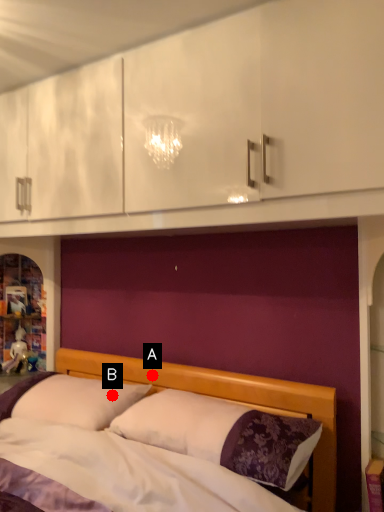
Question: Two points are circled on the image, labeled by A and B beside each circle. Which point is farther from the camera taking this photo?

Choices:
 (A) A is further
 (B) B is further

Answer: (A)